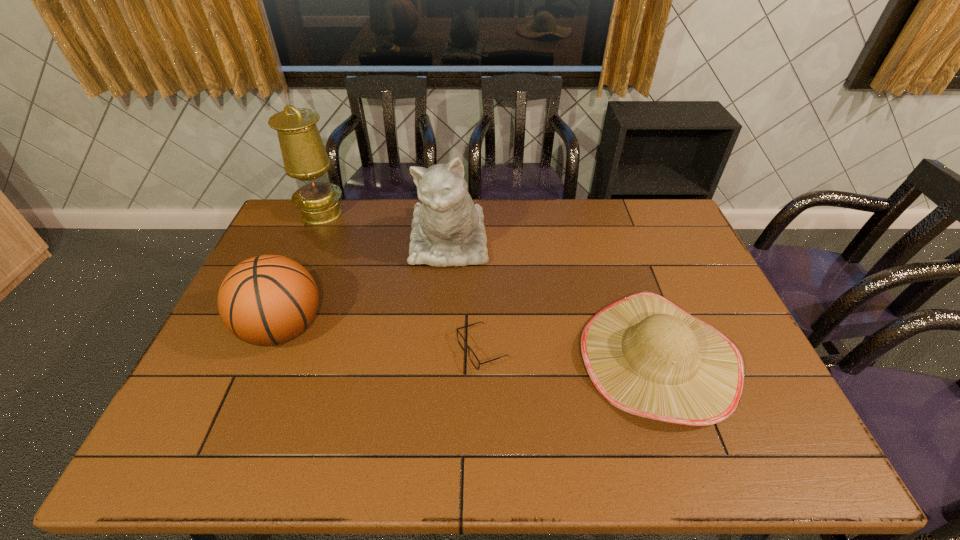
In order to click on oil lamp in this screenshot , I will do `click(305, 158)`.

Locate an element on the screen. The height and width of the screenshot is (540, 960). cat is located at coordinates (447, 228).

This screenshot has width=960, height=540. What are the coordinates of `basketball` in the screenshot? It's located at (267, 300).

Image resolution: width=960 pixels, height=540 pixels. I want to click on the rightmost object, so click(645, 355).

Locate an element on the screen. the second shortest object is located at coordinates (645, 355).

Find the location of a particular element. This screenshot has width=960, height=540. the shortest object is located at coordinates (473, 358).

Find the location of a particular element. This screenshot has height=540, width=960. vacant region located 0.200m on the right of the oil lamp is located at coordinates (399, 213).

You are a GUI agent. You are given a task and a screenshot of the screen. Output one action in this format:
    pyautogui.click(x=<x>, y=<y>)
    Task: Click on the free location located on the front-facing side of the cat
    Image resolution: width=960 pixels, height=540 pixels.
    Given the screenshot: What is the action you would take?
    pyautogui.click(x=438, y=378)

Locate an element on the screen. The height and width of the screenshot is (540, 960). free region located 0.060m on the front of the basketball is located at coordinates (260, 384).

I want to click on free location located on the back of the fourth tallest object, so 626,268.